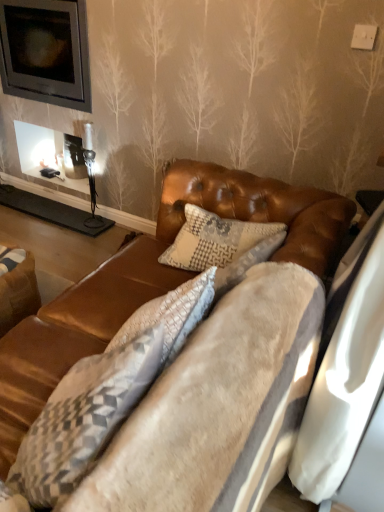
Question: From a real-world perspective, relative to velvet brown couch at center, is textured gray pillow at center vertically above or below?

Choices:
 (A) above
 (B) below

Answer: (B)

Question: Is textured gray pillow at center wider or thinner than velvet brown couch at center?

Choices:
 (A) thin
 (B) wide

Answer: (B)

Question: Which object is the closest to the brown leather swivel chair at lower left?

Choices:
 (A) velvet brown couch at center
 (B) textured gray pillow at center

Answer: (A)

Question: Based on their relative distances, which object is nearer to the velvet brown couch at center?

Choices:
 (A) textured gray pillow at center
 (B) brown leather swivel chair at lower left

Answer: (A)